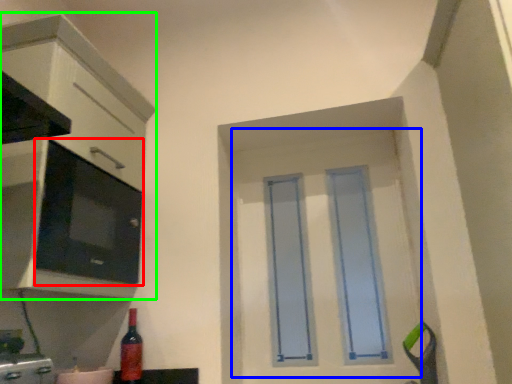
Question: Which is farther away from appliance (highlighted by a red box)? door (highlighted by a blue box) or cabinetry (highlighted by a green box)?

Choices:
 (A) door
 (B) cabinetry

Answer: (A)